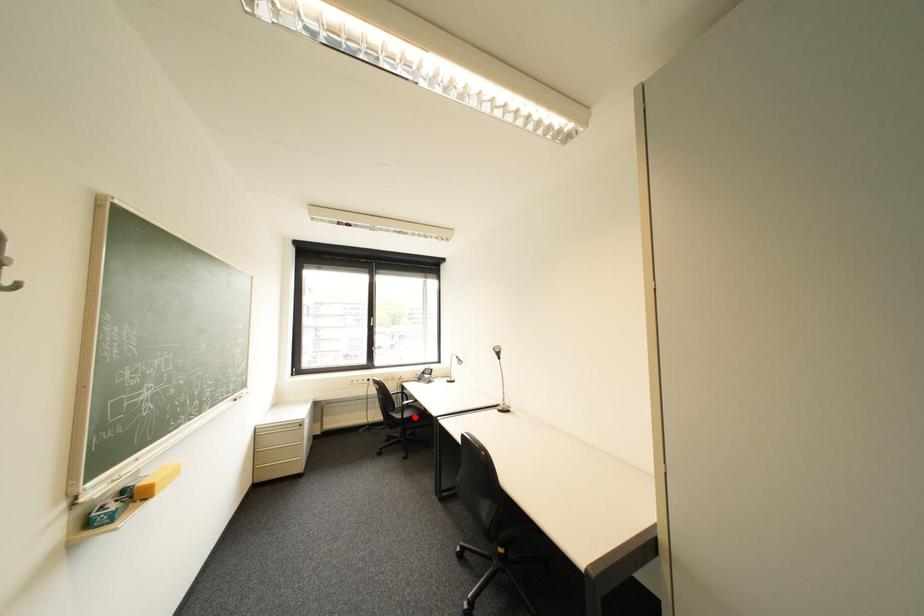
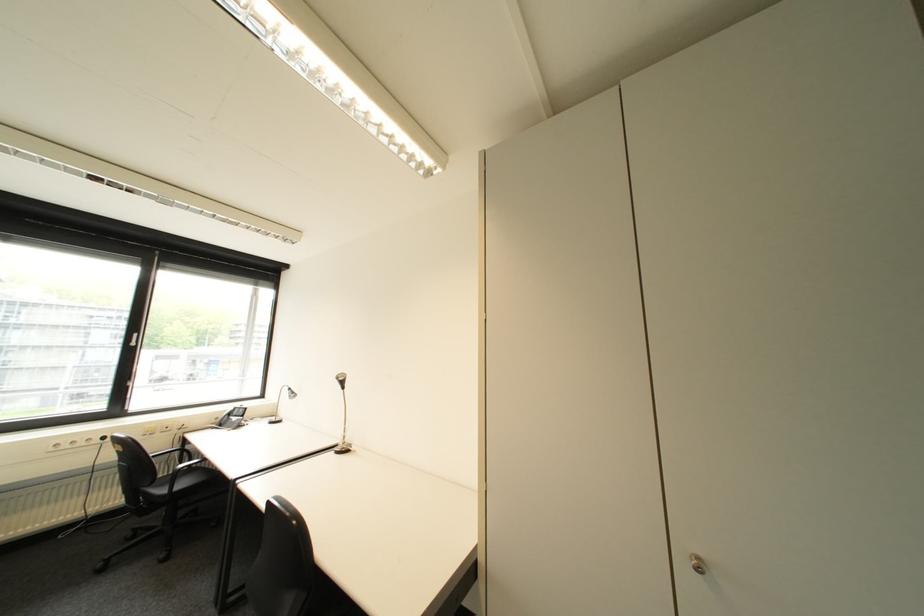
Question: I am providing you with two images of the same scene from different viewpoints. A red point is shown in image1. For the corresponding object point in image2, is it positioned nearer or farther from the camera?

Choices:
 (A) Nearer
 (B) Farther

Answer: (A)